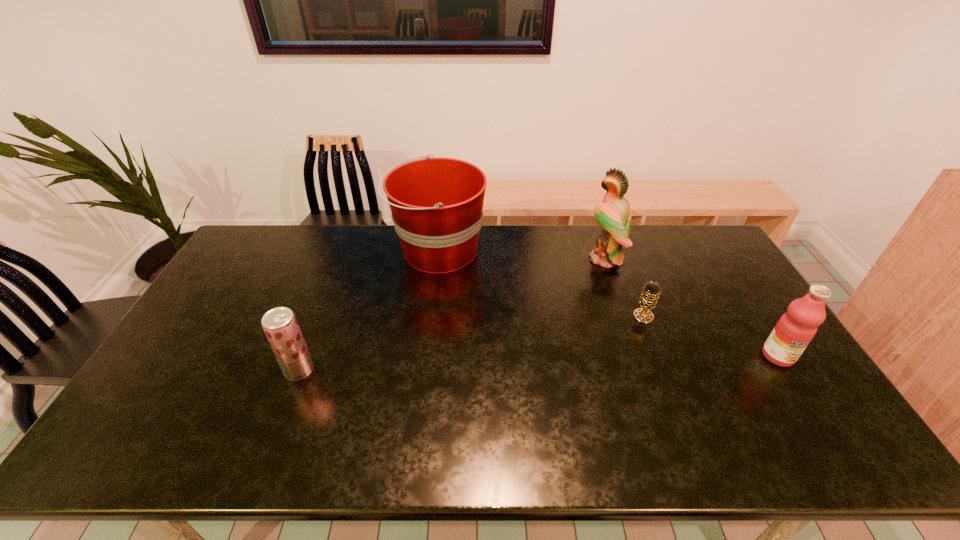
Locate an element on the screen. This screenshot has width=960, height=540. vacant space at the right edge is located at coordinates (712, 294).

Locate an element on the screen. free spot at the far right corner of the desktop is located at coordinates (684, 247).

Identify the location of empty space between the shorter fruit juice and the taller fruit juice. (539, 363).

Locate an element on the screen. vacant space that's between the fourth object from right to left and the parrot is located at coordinates (521, 255).

This screenshot has height=540, width=960. What are the coordinates of `free space between the taller fruit juice and the left fruit juice` in the screenshot? It's located at (539, 363).

This screenshot has height=540, width=960. In order to click on unoccupied position between the bucket and the taller fruit juice in this screenshot , I will do `click(608, 303)`.

At what (x,y) coordinates should I click in order to perform the action: click on free space between the right fruit juice and the chalice. Please return your answer as a coordinate pair (x, y). Looking at the image, I should click on (710, 336).

Image resolution: width=960 pixels, height=540 pixels. I want to click on free space between the rightmost object and the bucket, so click(x=608, y=303).

At what (x,y) coordinates should I click in order to perform the action: click on vacant space that's between the parrot and the rightmost object. Please return your answer as a coordinate pair (x, y). The width and height of the screenshot is (960, 540). Looking at the image, I should click on (691, 307).

You are a GUI agent. You are given a task and a screenshot of the screen. Output one action in this format:
    pyautogui.click(x=<x>, y=<y>)
    Task: Click on the blank region between the left fruit juice and the fourth object from right to left
    The width and height of the screenshot is (960, 540).
    Given the screenshot: What is the action you would take?
    pyautogui.click(x=369, y=310)